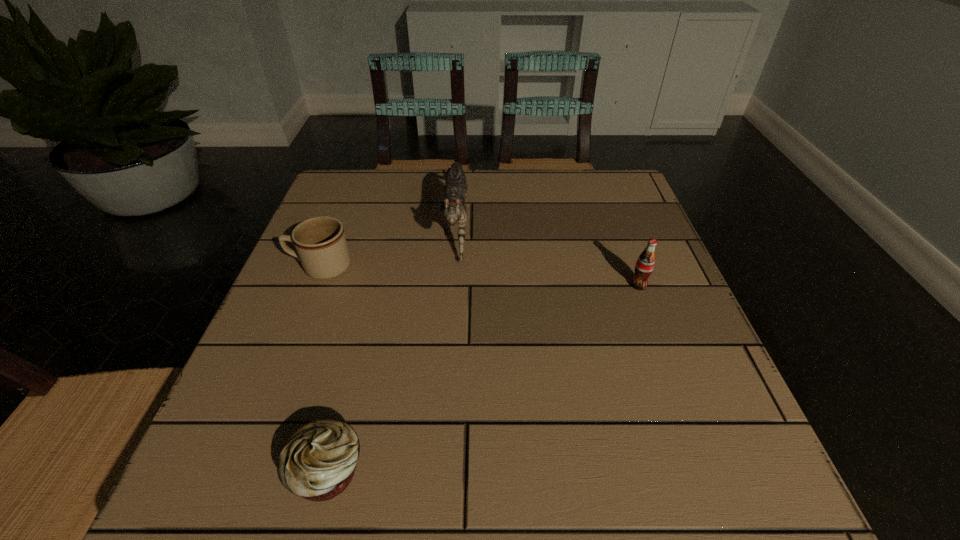
This screenshot has width=960, height=540. What are the coordinates of `blank space at the far left corner of the desktop` in the screenshot? It's located at point(328,211).

Identify the location of vacant area at the far right corner. (576, 205).

Where is `vacant area that lies between the mug and the nearest object`? This screenshot has height=540, width=960. vacant area that lies between the mug and the nearest object is located at coordinates point(324,369).

This screenshot has height=540, width=960. In order to click on vacant space in between the mug and the soda in this screenshot , I will do `click(480, 276)`.

You are a GUI agent. You are given a task and a screenshot of the screen. Output one action in this format:
    pyautogui.click(x=<x>, y=<y>)
    Task: Click on the free spot between the nearest object and the third object from left to right
    
    Given the screenshot: What is the action you would take?
    pyautogui.click(x=392, y=346)

Image resolution: width=960 pixels, height=540 pixels. In order to click on free space between the rightmost object and the shortest object in this screenshot , I will do click(x=483, y=378).

At what (x,y) coordinates should I click in order to perform the action: click on vacant area that lies between the third object from left to right and the second object from left to right. Please return your answer as a coordinate pair (x, y). The image size is (960, 540). Looking at the image, I should click on (392, 346).

This screenshot has width=960, height=540. I want to click on vacant space in between the third tallest object and the second object from left to right, so click(x=324, y=369).

Where is `empty location between the soda and the third object from left to right`? empty location between the soda and the third object from left to right is located at coordinates (547, 253).

Where is `empty space that is in between the tallest object and the leftmost object`? The height and width of the screenshot is (540, 960). empty space that is in between the tallest object and the leftmost object is located at coordinates (389, 244).